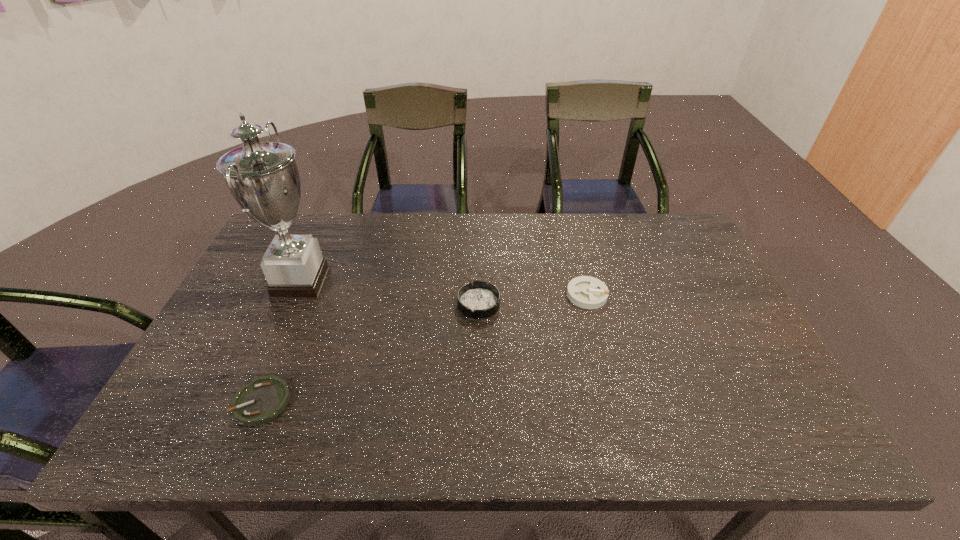
Identify the location of the tallest object. (263, 178).

Identify the location of the third object from left to right. (480, 299).

I want to click on the rightmost object, so click(x=587, y=292).

You are a GUI agent. You are given a task and a screenshot of the screen. Output one action in this format:
    pyautogui.click(x=<x>, y=<y>)
    Task: Click on the shortest object
    
    Given the screenshot: What is the action you would take?
    pyautogui.click(x=262, y=400)

In order to click on the nearest object in this screenshot , I will do `click(262, 400)`.

Where is `blank area located 0.090m at the front view of the tallest object`? blank area located 0.090m at the front view of the tallest object is located at coordinates (361, 282).

Locate an element on the screen. The height and width of the screenshot is (540, 960). free point located 0.240m on the left of the second ashtray from right to left is located at coordinates (372, 303).

Image resolution: width=960 pixels, height=540 pixels. In order to click on vacant region located on the front of the rightmost ashtray in this screenshot , I will do `click(597, 334)`.

The width and height of the screenshot is (960, 540). In order to click on vacant space located on the back of the leftmost ashtray in this screenshot , I will do (x=304, y=301).

The width and height of the screenshot is (960, 540). What are the coordinates of `object that is at the far edge` in the screenshot? It's located at (263, 178).